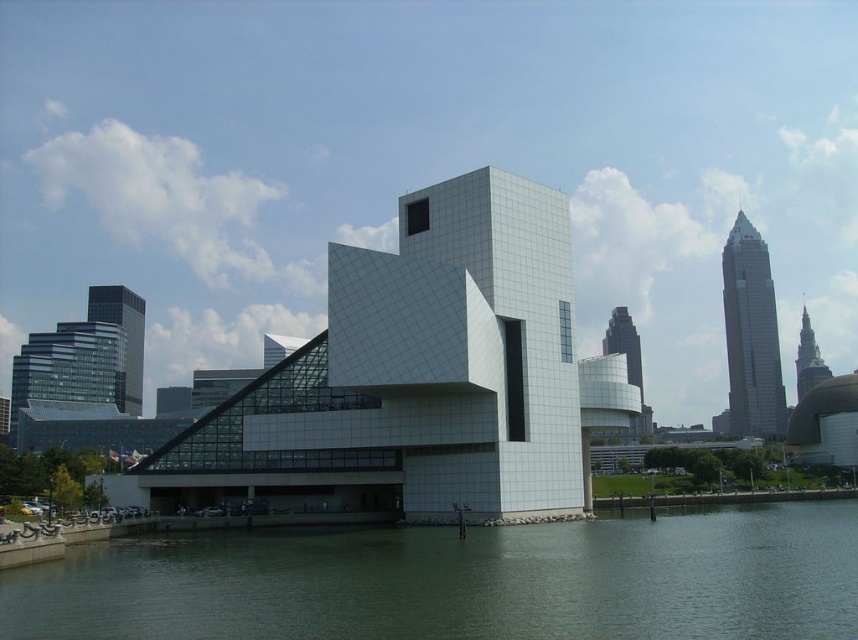
Is point (440, 621) in front of point (732, 280)?

Yes, point (440, 621) is in front of point (732, 280).

Who is more distant from viewer, (641,522) or (744,300)?

Positioned behind is point (744,300).

Is point (678, 636) more distant than point (724, 256)?

No.

Locate an element on the screen. The height and width of the screenshot is (640, 858). green smooth water at lower center is located at coordinates (462, 580).